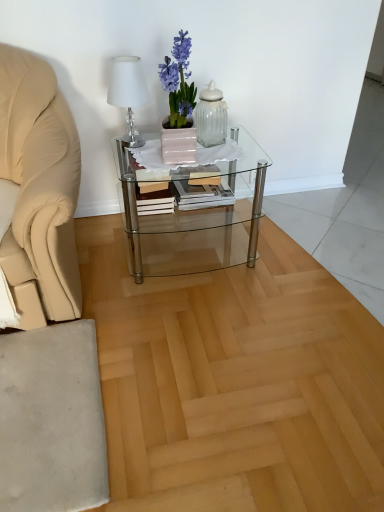
The image size is (384, 512). I want to click on vacant space in clear glass coffee table at center (from a real-world perspective), so click(189, 251).